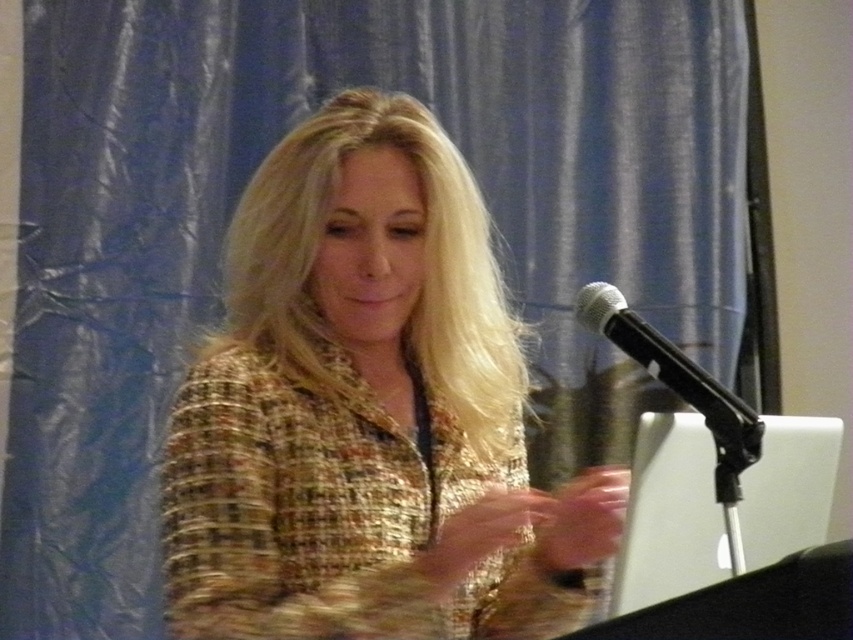
Question: Can you confirm if white plastic laptop at lower right is wider than black metallic microphone at upper right?

Choices:
 (A) no
 (B) yes

Answer: (B)

Question: Which of the following is the farthest from the observer?

Choices:
 (A) black metallic microphone at upper right
 (B) white plastic laptop at lower right

Answer: (B)

Question: Can you confirm if multicolored tweed jacket at center is smaller than white plastic laptop at lower right?

Choices:
 (A) no
 (B) yes

Answer: (A)

Question: Does white plastic laptop at lower right have a larger size compared to black metallic microphone at upper right?

Choices:
 (A) yes
 (B) no

Answer: (A)

Question: Which of these objects is positioned closest to the black metallic microphone at upper right?

Choices:
 (A) multicolored tweed jacket at center
 (B) white plastic laptop at lower right

Answer: (B)

Question: Estimate the real-world distances between objects in this image. Which object is farther from the multicolored tweed jacket at center?

Choices:
 (A) black metallic microphone at upper right
 (B) white plastic laptop at lower right

Answer: (B)